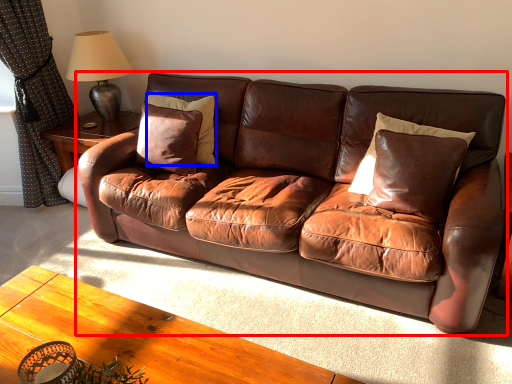
Question: Among these objects, which one is nearest to the camera, studio couch (highlighted by a red box) or pillow (highlighted by a blue box)?

Choices:
 (A) studio couch
 (B) pillow

Answer: (A)